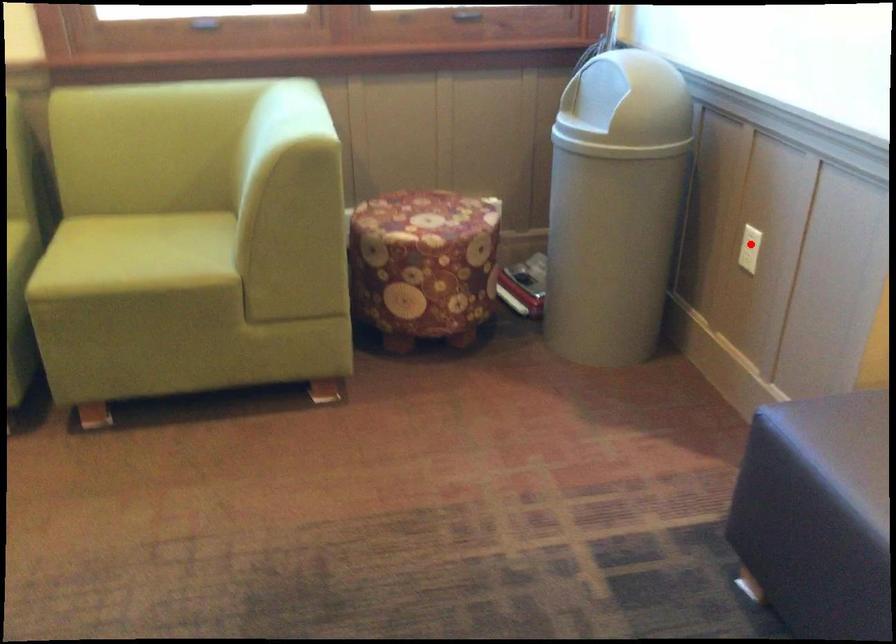
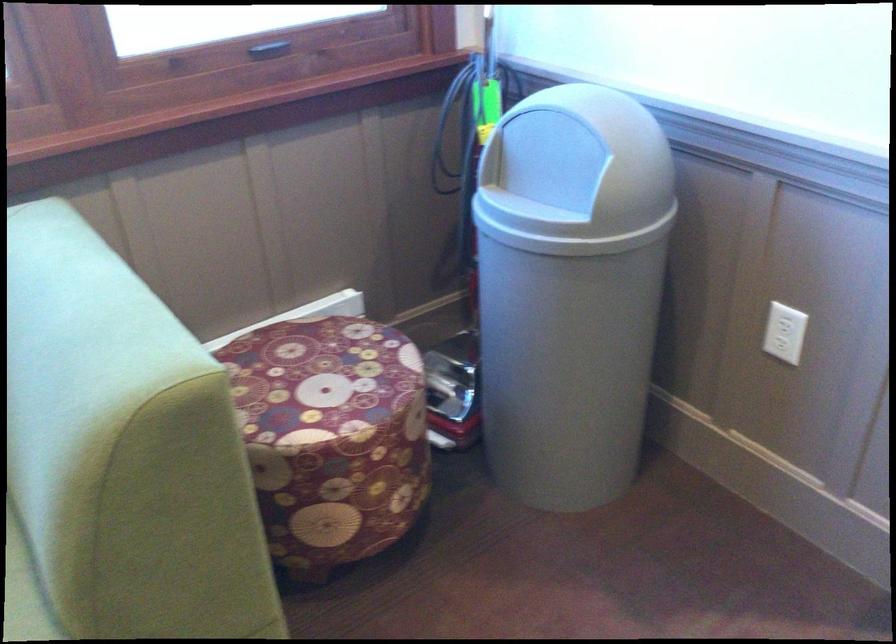
The point at the highlighted location is marked in the first image. Where is the corresponding point in the second image?

(787, 328)